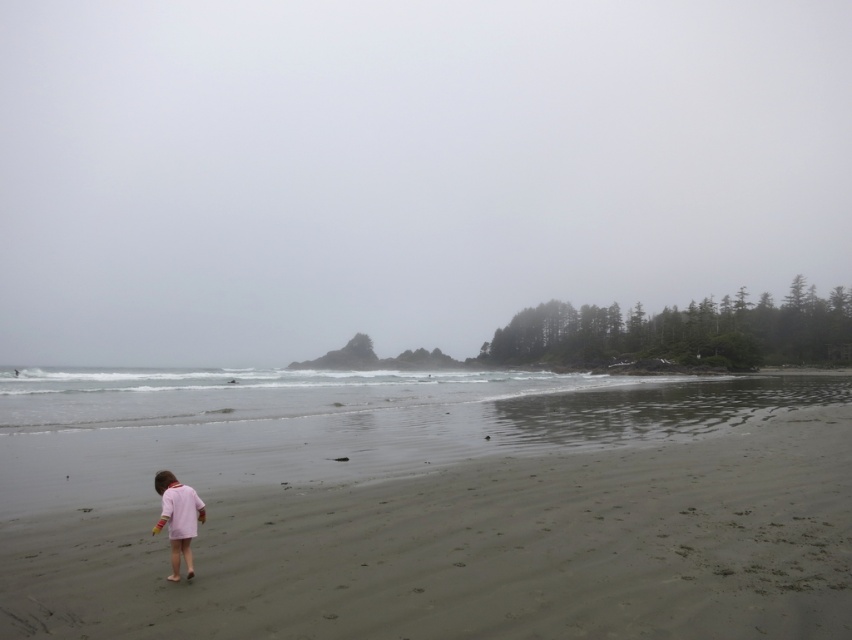
Is foggy sky at upper center thinner than smooth sand at lower center?

Incorrect, foggy sky at upper center's width is not less than smooth sand at lower center's.

What do you see at coordinates (403, 168) in the screenshot? I see `foggy sky at upper center` at bounding box center [403, 168].

Is point (626, 52) less distant than point (81, 595)?

No, it is not.

I want to click on foggy sky at upper center, so click(403, 168).

Based on the photo, who is more distant from viewer, (13, 145) or (160, 472)?

The point (13, 145) is behind.

Find the location of a particular element. The height and width of the screenshot is (640, 852). foggy sky at upper center is located at coordinates (403, 168).

Is smooth sand at lower center wider than pink matte dress at lower left?

Indeed, smooth sand at lower center has a greater width compared to pink matte dress at lower left.

Is the position of smooth sand at lower center less distant than that of pink matte dress at lower left?

Yes, it is.

You are a GUI agent. You are given a task and a screenshot of the screen. Output one action in this format:
    pyautogui.click(x=<x>, y=<y>)
    Task: Click on the smooth sand at lower center
    Image resolution: width=852 pixels, height=640 pixels.
    Given the screenshot: What is the action you would take?
    pyautogui.click(x=429, y=506)